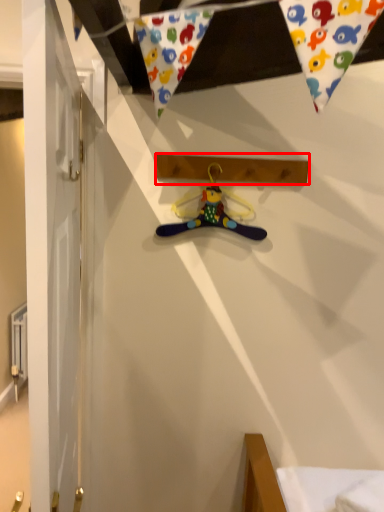
Question: Observing the image, what is the correct spatial positioning of plank (annotated by the red box) in reference to hanger?

Choices:
 (A) right
 (B) left

Answer: (A)